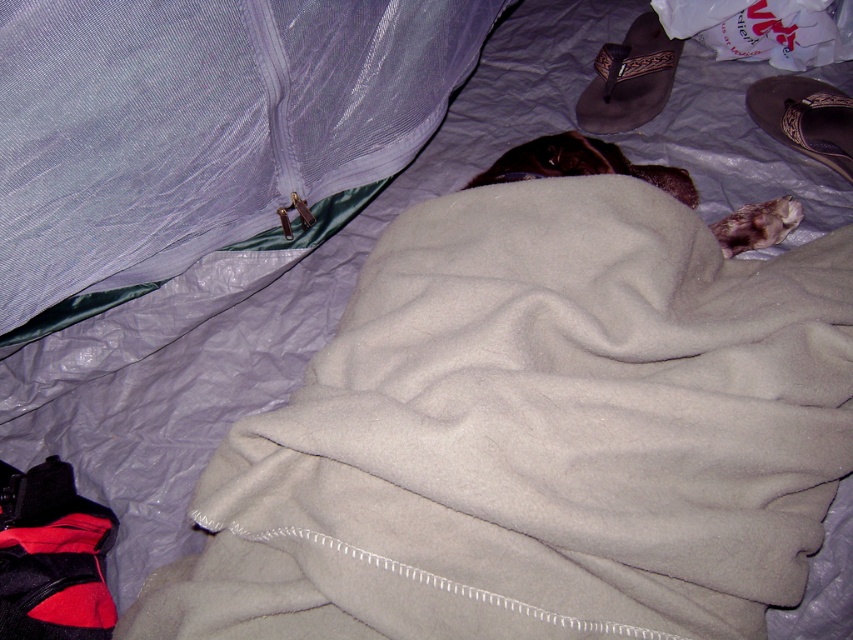
You are standing in front of the bed and want to reach the point at coordinates point [18,113]. If your arm can extend 3 feet, can you reach it?

The point [18,113] is 3.28 feet from the viewer, so your arm which can extend 3 feet is not long enough to reach it.

You are a cat owner who wants to ensure your fuzzy brown cat at center has enough space to move freely. The translucent purple fabric at upper left is part of a canopy bed. Is there enough space between the canopy and the cat?

The distance between the translucent purple fabric at upper left and the fuzzy brown cat at center is 36.54 centimeters, which should provide sufficient space for the cat to move comfortably.